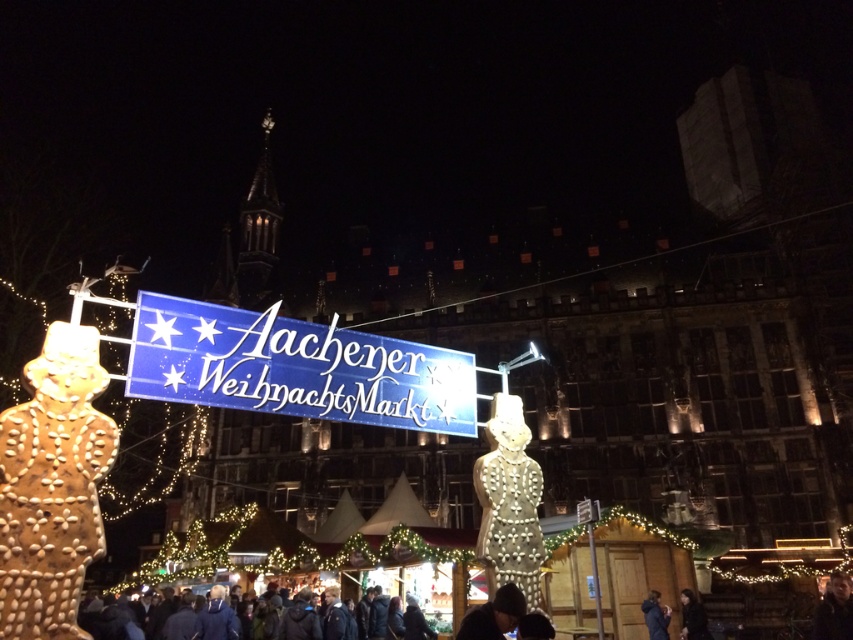
Based on the photo, you are standing at the entrance of the Aachen Christmas Market and see the illuminated gingerbread man at center and the dark blue jacket at lower center. Which object is positioned to the left?

The illuminated gingerbread man at center is to the left of the dark blue jacket at lower center.

Consider the image. You are standing at the entrance of the Aachen Christmas Market and want to take a photo of the illuminated gingerbread man at center. If the camera is at the origin point, what are the coordinates where you should aim to capture the gingerbread man?

The illuminated gingerbread man at center is located at point coordinates [509,502], so you should aim your camera at those coordinates to capture it.